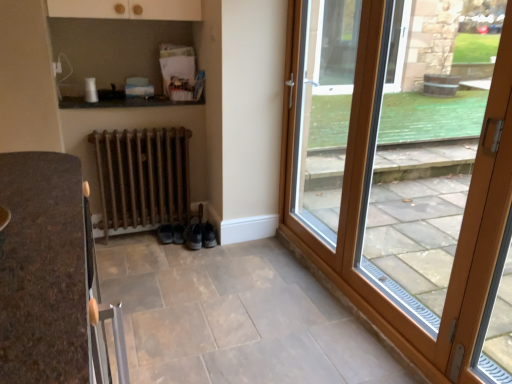
Question: Which direction should I rotate to look at black suede shoe at lower center, acting as the 2th shoe starting from the right?

Choices:
 (A) left
 (B) right

Answer: (A)

Question: Can we say leather black shoe at lower center, marked as the first shoe in a right-to-left arrangement, lies outside rusty metal radiator at lower center?

Choices:
 (A) yes
 (B) no

Answer: (A)

Question: From a real-world perspective, is leather black shoe at lower center, marked as the first shoe in a right-to-left arrangement, on rusty metal radiator at lower center?

Choices:
 (A) yes
 (B) no

Answer: (B)

Question: From the image's perspective, is leather black shoe at lower center, marked as the first shoe in a right-to-left arrangement, on rusty metal radiator at lower center?

Choices:
 (A) yes
 (B) no

Answer: (B)

Question: Is leather black shoe at lower center, which is the 2th shoe in left-to-right order, directly adjacent to rusty metal radiator at lower center?

Choices:
 (A) yes
 (B) no

Answer: (B)

Question: Is leather black shoe at lower center, which is the 2th shoe in left-to-right order, far from rusty metal radiator at lower center?

Choices:
 (A) no
 (B) yes

Answer: (A)

Question: Is leather black shoe at lower center, which is the 2th shoe in left-to-right order, surrounding rusty metal radiator at lower center?

Choices:
 (A) yes
 (B) no

Answer: (B)

Question: Does wooden door at right, which ranks as the second door in left-to-right order, come behind leather black shoe at lower center, which is the 2th shoe in left-to-right order?

Choices:
 (A) no
 (B) yes

Answer: (A)

Question: From a real-world perspective, is wooden door at right, which ranks as the second door in left-to-right order, under leather black shoe at lower center, marked as the first shoe in a right-to-left arrangement?

Choices:
 (A) yes
 (B) no

Answer: (B)

Question: Considering the relative positions of wooden door at right, which is the 1th door from right to left, and leather black shoe at lower center, marked as the first shoe in a right-to-left arrangement, in the image provided, is wooden door at right, which is the 1th door from right to left, to the left of leather black shoe at lower center, marked as the first shoe in a right-to-left arrangement, from the viewer's perspective?

Choices:
 (A) no
 (B) yes

Answer: (A)

Question: Is wooden door at right, which ranks as the second door in left-to-right order, outside leather black shoe at lower center, which is the 2th shoe in left-to-right order?

Choices:
 (A) no
 (B) yes

Answer: (B)

Question: From the image's perspective, is wooden door at right, which is the 1th door from right to left, below leather black shoe at lower center, marked as the first shoe in a right-to-left arrangement?

Choices:
 (A) no
 (B) yes

Answer: (A)

Question: Is wooden door at right, which ranks as the second door in left-to-right order, taller than leather black shoe at lower center, which is the 2th shoe in left-to-right order?

Choices:
 (A) no
 (B) yes

Answer: (B)

Question: Considering the relative positions of rusty metal radiator at lower center and wooden glass door at right, the 2th door in the right-to-left sequence, in the image provided, is rusty metal radiator at lower center in front of wooden glass door at right, the 2th door in the right-to-left sequence,?

Choices:
 (A) no
 (B) yes

Answer: (A)